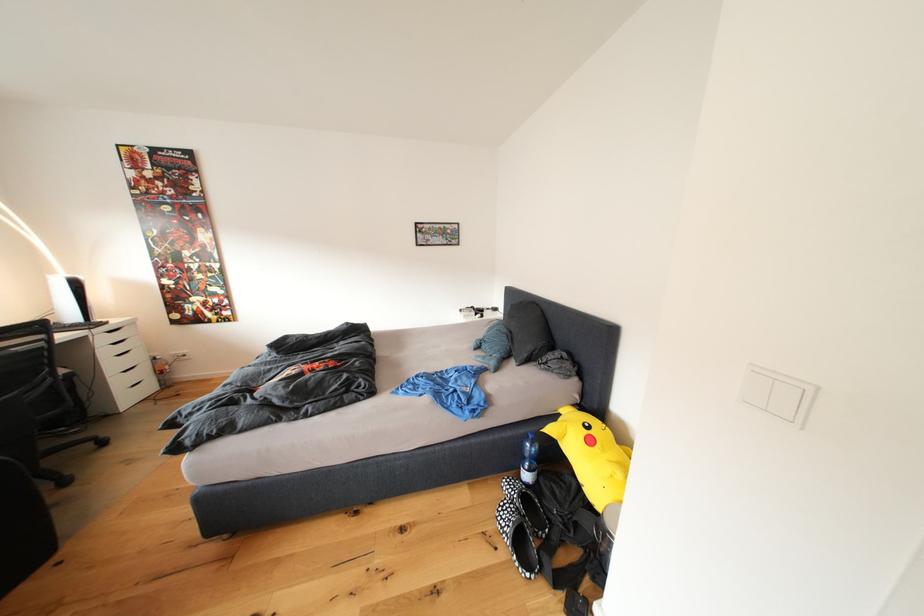
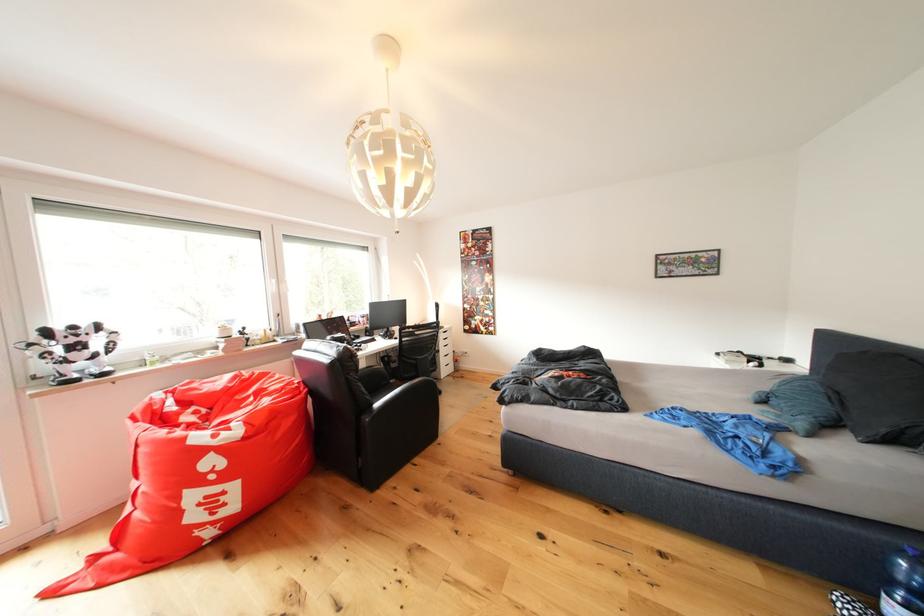
Question: How did the camera likely rotate?

Choices:
 (A) Left
 (B) Right
 (C) Up
 (D) Down

Answer: (A)